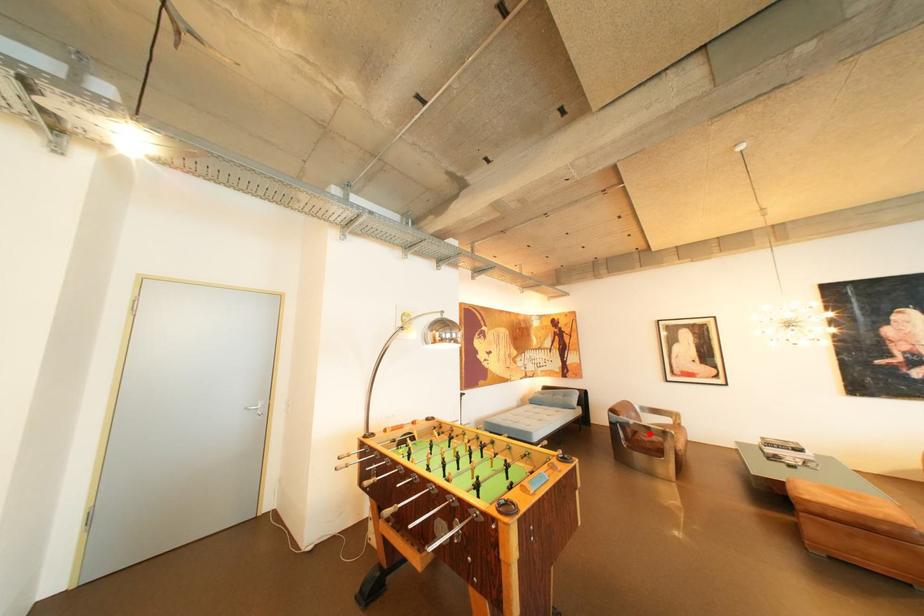
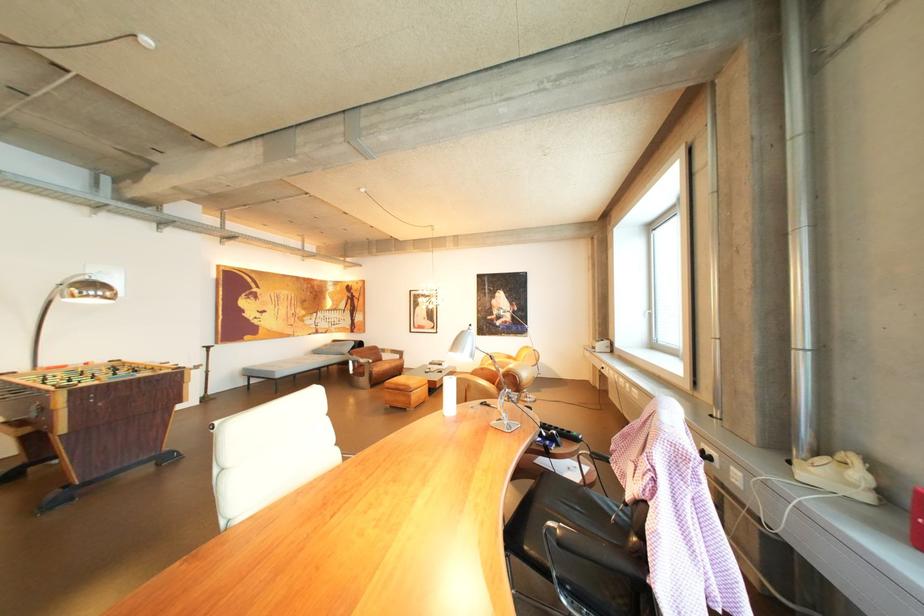
Question: I am providing you with two images of the same scene from different viewpoints. A red point is shown in image1. For the corresponding object point in image2, is it positioned nearer or farther from the camera?

Choices:
 (A) Nearer
 (B) Farther

Answer: (A)